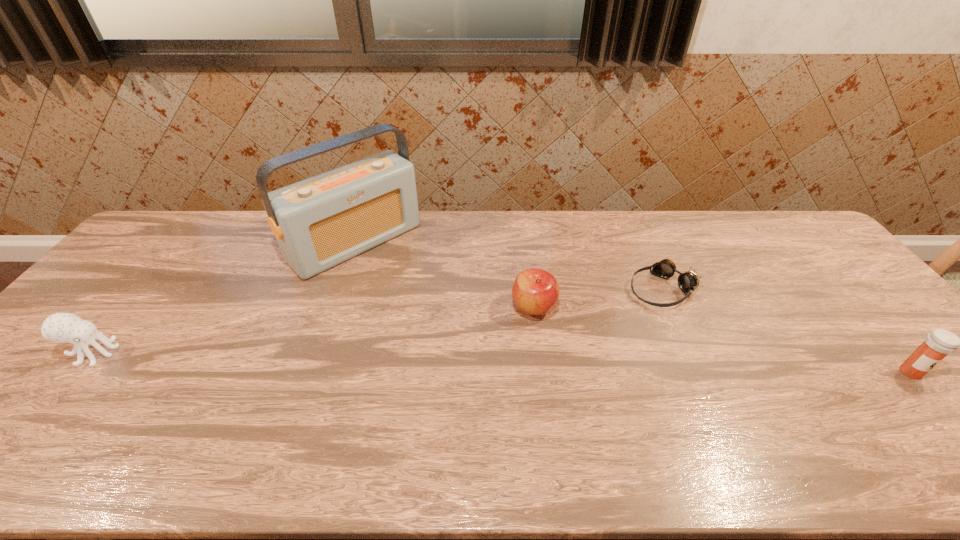
Where is `free spot at the far edge of the desktop`? free spot at the far edge of the desktop is located at coordinates (588, 222).

In the image, there is a desktop. Where is `vacant space at the near edge`? This screenshot has height=540, width=960. vacant space at the near edge is located at coordinates (735, 416).

The height and width of the screenshot is (540, 960). What are the coordinates of `vacant space at the left edge of the desktop` in the screenshot? It's located at (148, 258).

The height and width of the screenshot is (540, 960). What are the coordinates of `free space at the right edge of the desktop` in the screenshot? It's located at (868, 316).

Where is `vacant space at the far left corner`? vacant space at the far left corner is located at coordinates (196, 217).

Locate an element on the screen. Image resolution: width=960 pixels, height=540 pixels. vacant region between the medicine and the third object from left to right is located at coordinates (722, 340).

Image resolution: width=960 pixels, height=540 pixels. Find the location of `vacant space that's between the shortest object and the third object from left to right`. vacant space that's between the shortest object and the third object from left to right is located at coordinates (599, 298).

Where is `free area in between the tallest object and the octopus`? The height and width of the screenshot is (540, 960). free area in between the tallest object and the octopus is located at coordinates (225, 298).

Find the location of a particular element. vacant space that's between the shortest object and the tallest object is located at coordinates (510, 266).

Locate an element on the screen. The image size is (960, 540). free spot between the leftmost object and the goggles is located at coordinates point(379,321).